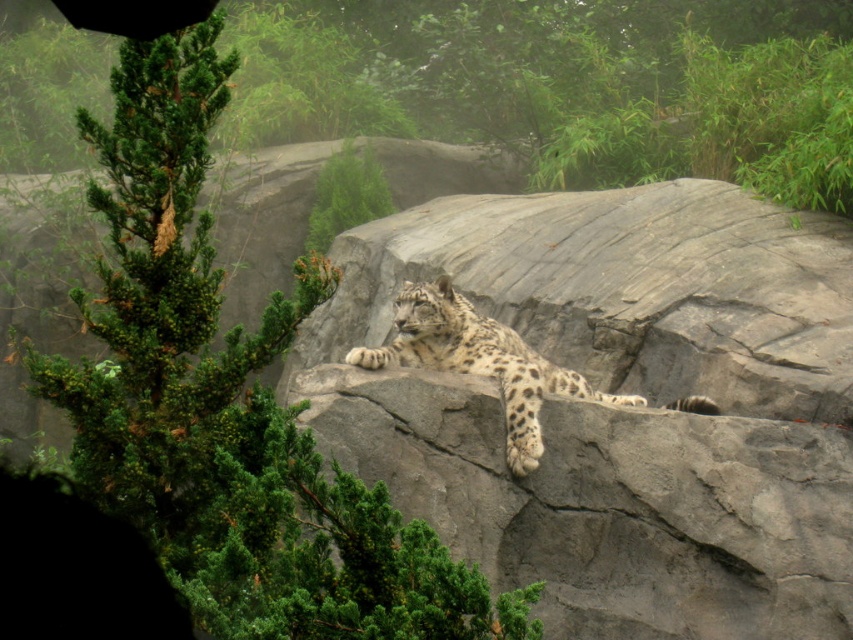
You are a wildlife photographer aiming to capture the spotted fur snow leopard at center. You notice the gray rough rock at center in the background. From the leopard, which direction should you move to get a better shot of the rock behind it?

Since the gray rough rock at center is to the right of the spotted fur snow leopard at center, you should move to the right of the leopard to position the rock behind it in your shot.

You are a wildlife photographer aiming to capture a closeup shot of the spotted fur snow leopard at center. You are currently positioned near the green textured pine tree at upper left. Given that your camera has a maximum zoom range of 10 feet, will you be able to get a clear closeup without moving closer?

The green textured pine tree at upper left and spotted fur snow leopard at center are 14.10 feet apart. Since your camera can only zoom up to 10 feet, you will need to move closer to the spotted fur snow leopard at center to get a clear closeup.

You are a wildlife photographer aiming to capture a close shot of the snow leopard. You are currently positioned at point (154, 282). The camera you are using has a maximum focus range of 5 meters. Can you take a clear photo of the snow leopard from your current position?

The distance between point (154, 282) and the camera is 4.82 meters, which is within the camera maximum focus range of 5 meters. Therefore, you can take a clear photo of the snow leopard from your current position.